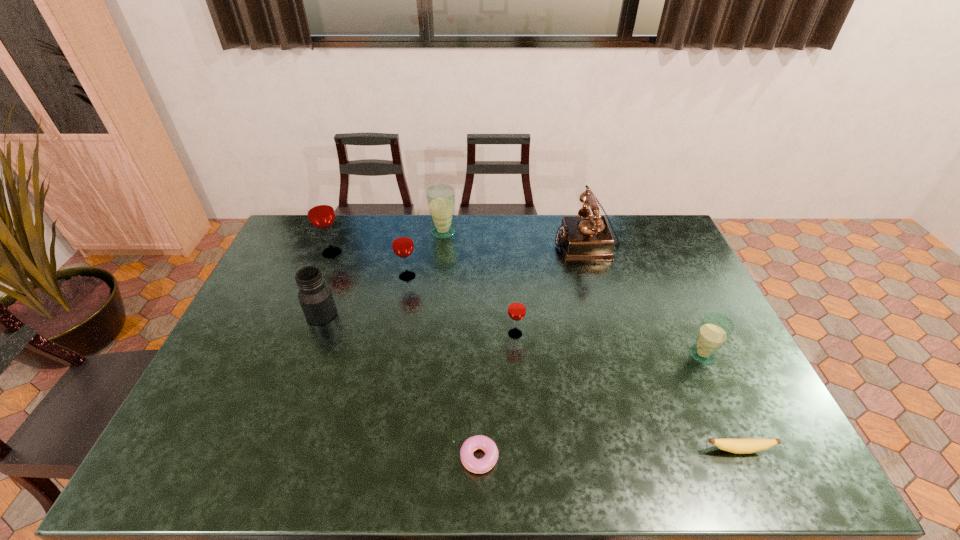
Where is `vacant region located on the dial of the brown telephone`? The image size is (960, 540). vacant region located on the dial of the brown telephone is located at coordinates (481, 243).

Where is `blank area located 0.180m on the right of the second nearest red glass`? This screenshot has width=960, height=540. blank area located 0.180m on the right of the second nearest red glass is located at coordinates (470, 276).

The height and width of the screenshot is (540, 960). In order to click on vacant area located on the left of the farthest glass in this screenshot , I will do `click(361, 232)`.

In order to click on free region located 0.360m on the back of the fifth nearest object in this screenshot , I will do `click(350, 235)`.

Identify the location of free space located 0.220m on the front of the smaller blue glass. (742, 442).

The image size is (960, 540). I want to click on free location located on the front of the sixth object from left to right, so click(518, 378).

Find the location of `vacant space located on the left of the eighth tallest object`. vacant space located on the left of the eighth tallest object is located at coordinates (542, 450).

The image size is (960, 540). Find the location of `vacant space situated on the right of the shortest object`. vacant space situated on the right of the shortest object is located at coordinates (614, 458).

In order to click on telephone that is at the far edge in this screenshot , I will do `click(584, 238)`.

Find the location of `banana located in the near edge section of the desktop`. banana located in the near edge section of the desktop is located at coordinates (738, 446).